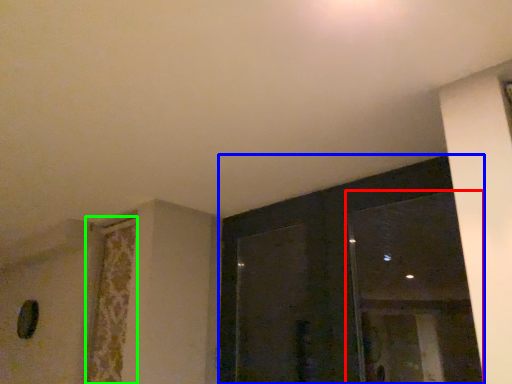
Question: Which is nearer to the window (highlighted by a red box)? window (highlighted by a blue box) or curtain (highlighted by a green box).

Choices:
 (A) window
 (B) curtain

Answer: (A)